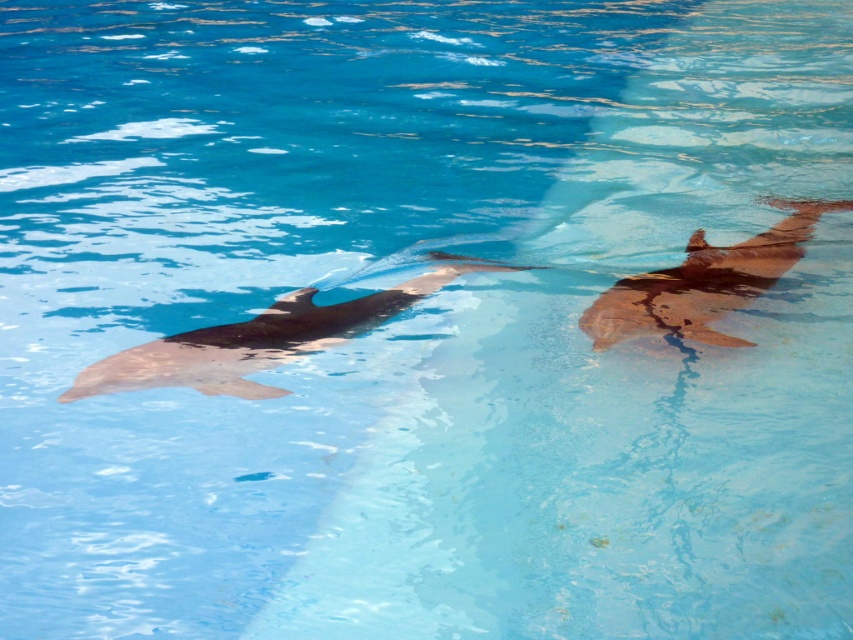
This screenshot has width=853, height=640. What do you see at coordinates (262, 339) in the screenshot?
I see `smooth gray dolphin at center` at bounding box center [262, 339].

Is smooth gray dolphin at center above smooth brown dolphin at right?

No.

Who is more forward, (x=193, y=330) or (x=730, y=282)?

Point (x=193, y=330) is in front.

Locate an element on the screen. smooth gray dolphin at center is located at coordinates (262, 339).